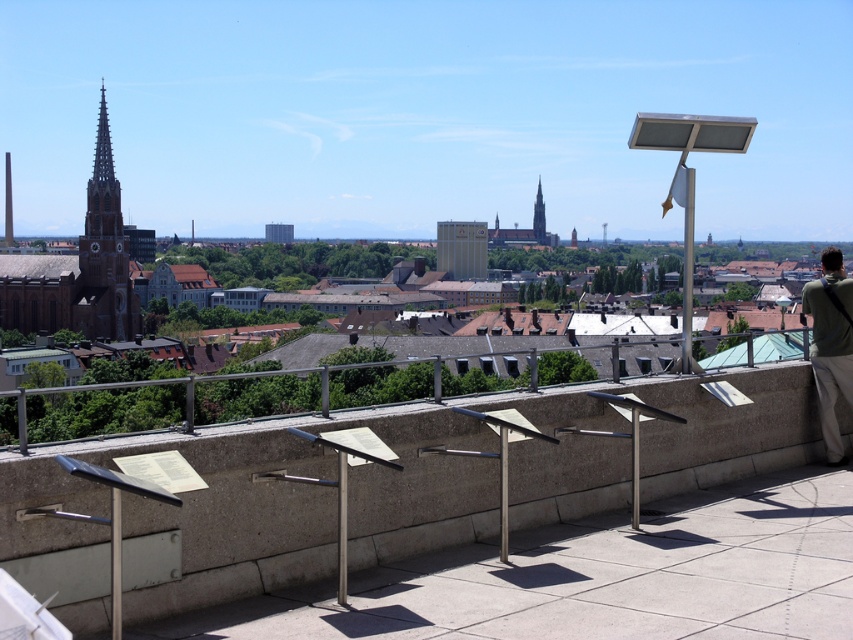
Question: Which of these objects is positioned closest to the smooth glass spire at center?

Choices:
 (A) metallic pole at lower left
 (B) matte gold spire at left

Answer: (B)

Question: Which point is closer to the camera?

Choices:
 (A) (405, 424)
 (B) (111, 634)
 (C) (821, 253)
 (D) (538, 195)

Answer: (B)

Question: Which point is closer to the camera taking this photo?

Choices:
 (A) (254, 492)
 (B) (834, 456)
 (C) (117, 529)

Answer: (C)

Question: Is green fabric bag at right below smooth glass spire at center?

Choices:
 (A) yes
 (B) no

Answer: (A)

Question: Does metallic pole at upper center have a greater width compared to smooth glass spire at center?

Choices:
 (A) no
 (B) yes

Answer: (B)

Question: Can you confirm if green fabric bag at right is thinner than smooth glass spire at center?

Choices:
 (A) no
 (B) yes

Answer: (A)